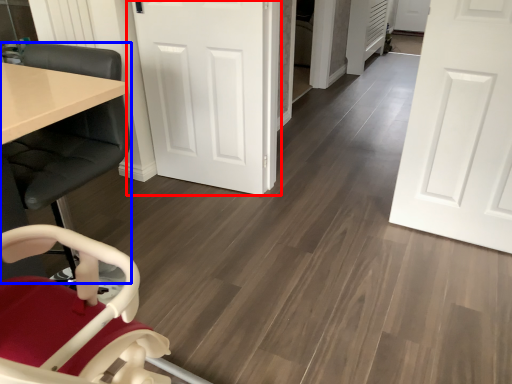
Question: Which point is closer to the camera, door (highlighted by a red box) or chair (highlighted by a blue box)?

Choices:
 (A) door
 (B) chair

Answer: (B)